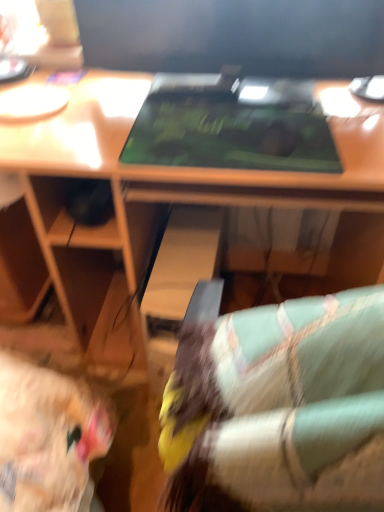
Question: Considering their positions, is green matte laptop at center located in front of or behind matte black monitor at upper center?

Choices:
 (A) behind
 (B) front

Answer: (B)

Question: From their relative heights in the image, would you say green matte laptop at center is taller or shorter than matte black monitor at upper center?

Choices:
 (A) short
 (B) tall

Answer: (A)

Question: Based on their sizes in the image, would you say green matte laptop at center is bigger or smaller than matte black monitor at upper center?

Choices:
 (A) big
 (B) small

Answer: (B)

Question: Is matte black monitor at upper center wider or thinner than green matte laptop at center?

Choices:
 (A) thin
 (B) wide

Answer: (A)

Question: In the image, is matte black monitor at upper center positioned in front of or behind green matte laptop at center?

Choices:
 (A) behind
 (B) front

Answer: (A)

Question: Considering the positions of point (302, 64) and point (183, 110), is point (302, 64) closer or farther from the camera than point (183, 110)?

Choices:
 (A) closer
 (B) farther

Answer: (B)

Question: Visually, is matte black monitor at upper center positioned to the left or to the right of green matte laptop at center?

Choices:
 (A) right
 (B) left

Answer: (A)